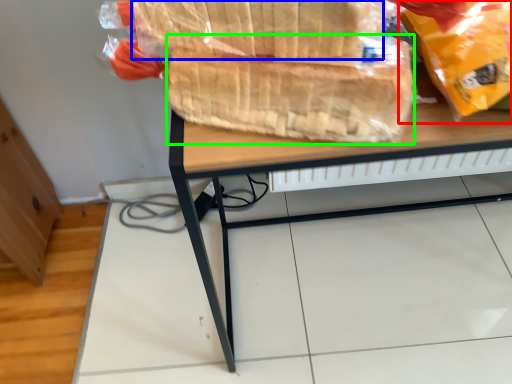
Question: Which object is the farthest from plastic bag (highlighted by a red box)? Choose among these: bread (highlighted by a blue box) or bread (highlighted by a green box).

Choices:
 (A) bread
 (B) bread

Answer: (A)